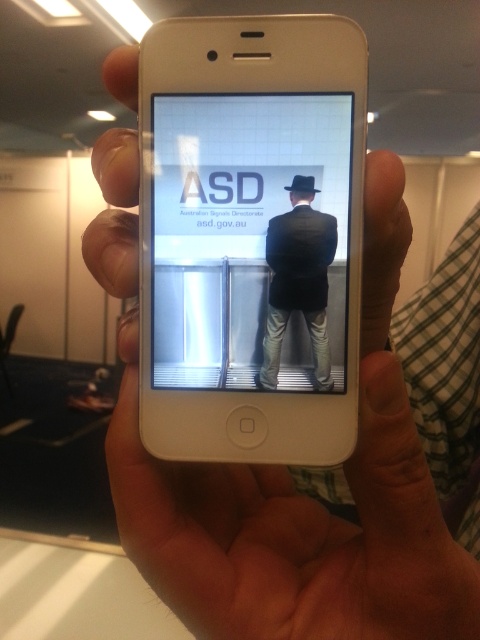
What are the coordinates of the white glossy poster at center?

The white glossy poster at center is located at point (240, 228).